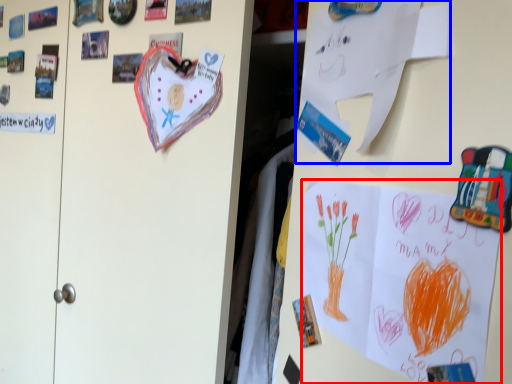
Question: Which object is closer to the camera taking this photo, poster (highlighted by a red box) or paper (highlighted by a blue box)?

Choices:
 (A) poster
 (B) paper

Answer: (A)